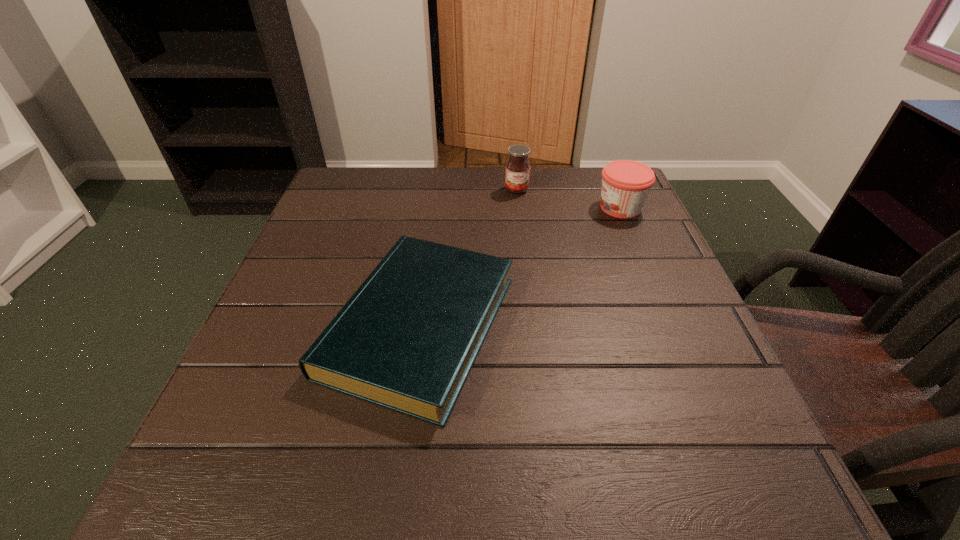
Where is `object that is at the right edge`? object that is at the right edge is located at coordinates (626, 184).

Identify the location of object that is at the far right corner. (626, 184).

Locate an element on the screen. The image size is (960, 540). blank area at the far edge is located at coordinates (396, 173).

Where is `free region at the near edge`? This screenshot has height=540, width=960. free region at the near edge is located at coordinates (564, 498).

Where is `vacant space at the left edge`? This screenshot has height=540, width=960. vacant space at the left edge is located at coordinates (267, 313).

The width and height of the screenshot is (960, 540). In the image, there is a desktop. In order to click on vacant space at the right edge in this screenshot , I will do `click(644, 341)`.

This screenshot has height=540, width=960. Find the location of `free space at the far left corner of the desktop`. free space at the far left corner of the desktop is located at coordinates (367, 207).

I want to click on free space at the near right corner, so click(716, 462).

The image size is (960, 540). In order to click on free spot between the rightmost object and the left jam in this screenshot , I will do `click(568, 199)`.

Where is `free point between the rightmost object and the second object from right to left`? Image resolution: width=960 pixels, height=540 pixels. free point between the rightmost object and the second object from right to left is located at coordinates (568, 199).